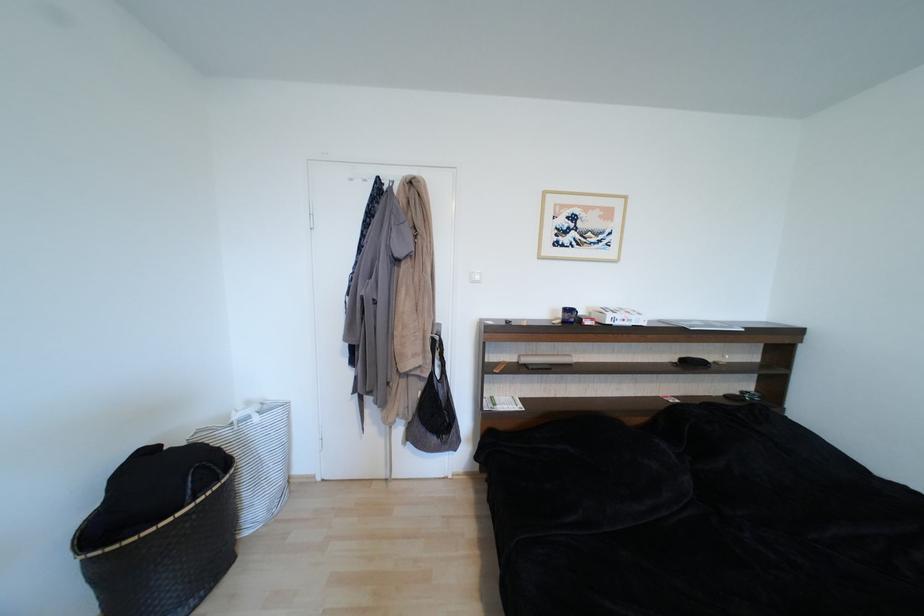
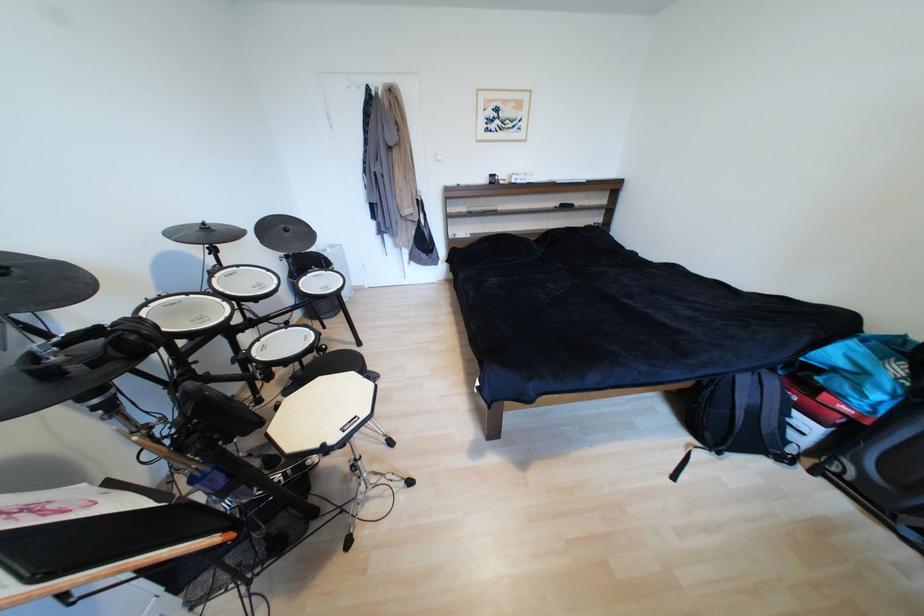
Question: The images are taken continuously from a first-person perspective. In which direction are you moving?

Choices:
 (A) Left
 (B) Right
 (C) Forward
 (D) Backward

Answer: (D)